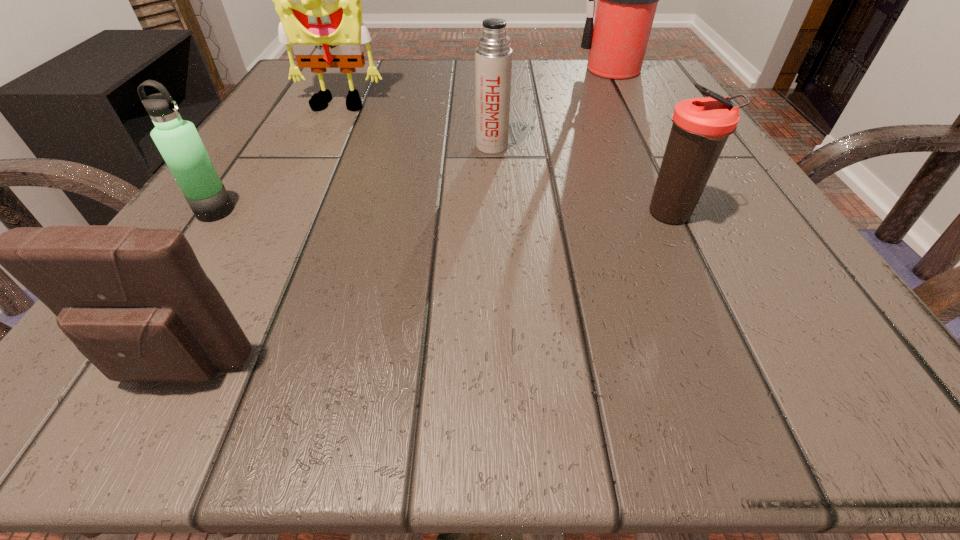
You are a GUI agent. You are given a task and a screenshot of the screen. Output one action in this format:
    pyautogui.click(x=<x>, y=<y>)
    Task: Click on the tallest object
    
    Given the screenshot: What is the action you would take?
    [x=627, y=0]

You are a GUI agent. You are given a task and a screenshot of the screen. Output one action in this format:
    pyautogui.click(x=<x>, y=<y>)
    Task: Click on the farthest object
    This screenshot has width=960, height=540.
    Given the screenshot: What is the action you would take?
    pyautogui.click(x=627, y=0)

This screenshot has height=540, width=960. In order to click on the fifth shortest object in this screenshot , I will do `click(318, 0)`.

Find the location of a particular element. This screenshot has width=960, height=540. sponge is located at coordinates (318, 0).

Where is `the second thermos bottle from right to left`? The height and width of the screenshot is (540, 960). the second thermos bottle from right to left is located at coordinates (493, 57).

Identify the location of the fourth nearest object. The width and height of the screenshot is (960, 540). (493, 57).

The height and width of the screenshot is (540, 960). Find the location of `the leftmost thermos bottle`. the leftmost thermos bottle is located at coordinates (178, 141).

Locate an element on the screen. Image resolution: width=960 pixels, height=540 pixels. the rightmost thermos bottle is located at coordinates (701, 126).

Image resolution: width=960 pixels, height=540 pixels. I want to click on the nearest object, so click(x=135, y=302).

Find the location of a particular element. The width and height of the screenshot is (960, 540). vacant region located 0.400m on the hose direction of the farthest object is located at coordinates (377, 70).